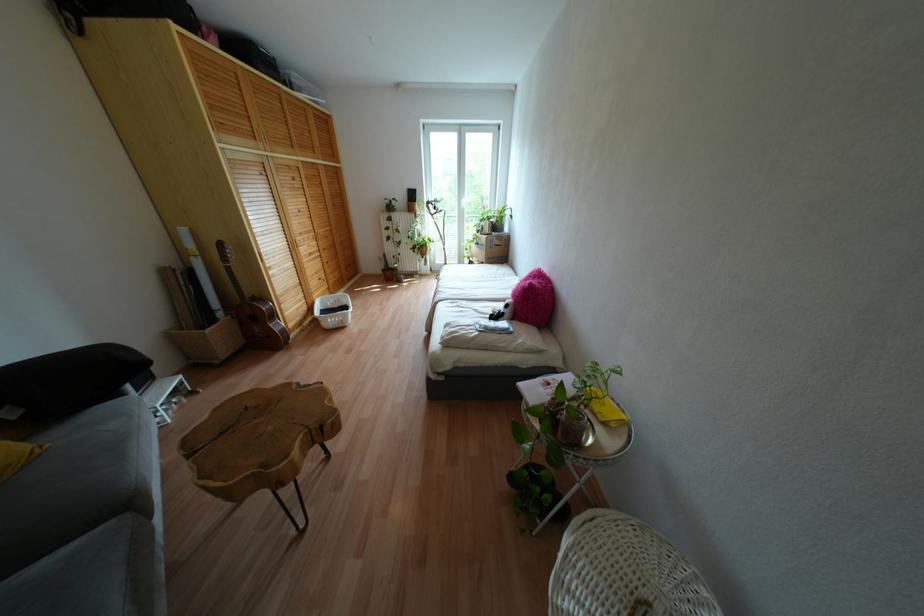
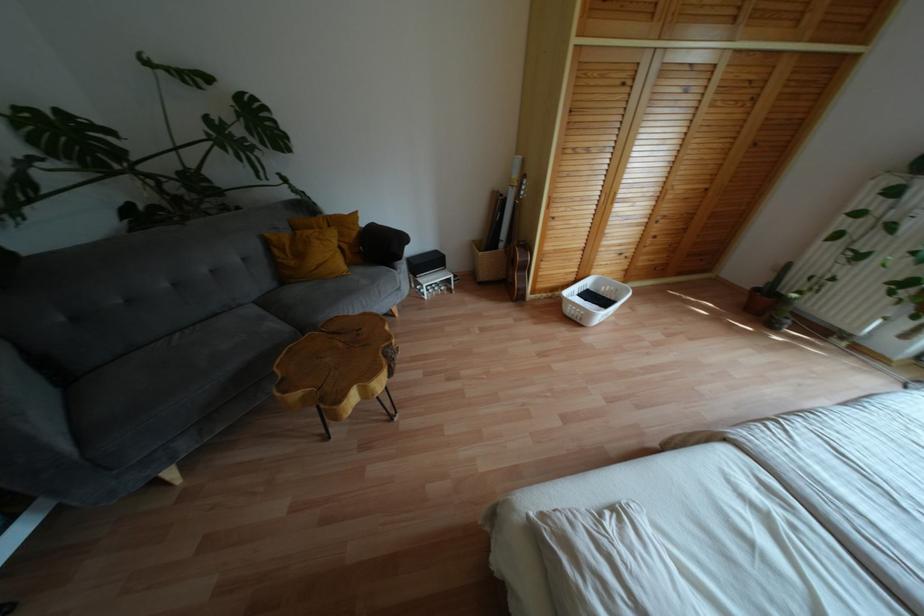
Locate, in the second image, the point that corresponds to point (273, 314) in the first image.

(525, 267)